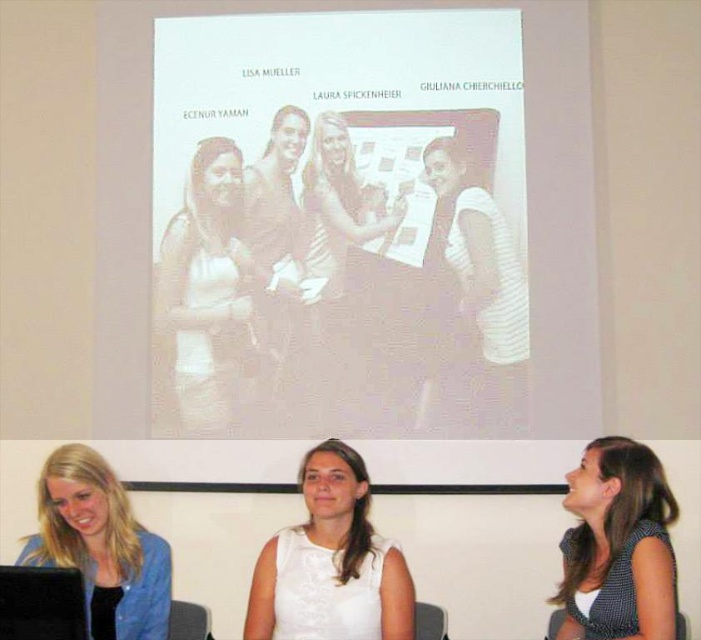
Does matte blue shirt at lower left have a greater width compared to white fabric dress at center?

Yes, matte blue shirt at lower left is wider than white fabric dress at center.

Can you confirm if matte blue shirt at lower left is smaller than white fabric dress at center?

Actually, matte blue shirt at lower left might be larger than white fabric dress at center.

Who is more distant from viewer, (102,458) or (390,218)?

The point (390,218) is behind.

Locate an element on the screen. The width and height of the screenshot is (701, 640). matte blue shirt at lower left is located at coordinates (100, 545).

Who is lower down, white matte shirt at center or white matte dress at center?

white matte dress at center is lower down.

Is point (191, 330) in front of point (287, 595)?

No.

Who is more forward, [233,164] or [339,472]?

Point [339,472] is in front.

Image resolution: width=701 pixels, height=640 pixels. In order to click on white matte shirt at center in this screenshot , I will do `click(205, 300)`.

Looking at this image, does white dotted shirt at lower right have a greater height compared to matte blue shirt at lower left?

Indeed, white dotted shirt at lower right has a greater height compared to matte blue shirt at lower left.

Can you confirm if white dotted shirt at lower right is thinner than matte blue shirt at lower left?

Correct, white dotted shirt at lower right's width is less than matte blue shirt at lower left's.

Between point (606, 500) and point (55, 452), which one is positioned in front?

Positioned in front is point (606, 500).

At what (x,y) coordinates should I click in order to perform the action: click on white dotted shirt at lower right. Please return your answer as a coordinate pair (x, y). The height and width of the screenshot is (640, 701). Looking at the image, I should click on (618, 545).